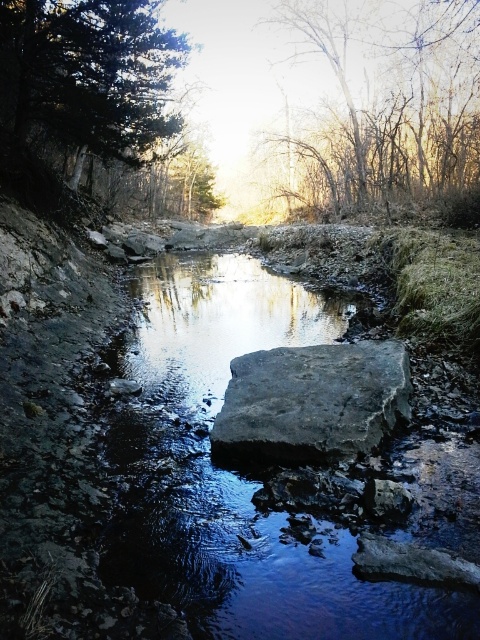
You are standing at the edge of the stream and want to cross to the other side. The smooth stone stream at center is in your way. Can you step on it to cross?

The smooth stone stream at center is located at point (232, 474), so yes, you can step on it to cross the stream.

You are a hiker trying to cross the stream. You see the smooth stone stream at center and the smooth bark trees at upper center. Which one is narrower?

The smooth stone stream at center is narrower than the smooth bark trees at upper center.

You are standing at the edge of the stream and want to cross it using the two points marked in the image. The first point is at coordinates point [324,557] and the second is at point [439,45]. Which point should you step on first to reach the other side more easily?

You should step on point [324,557] first because it is closer to you than point [439,45], making it easier to reach when crossing the stream.